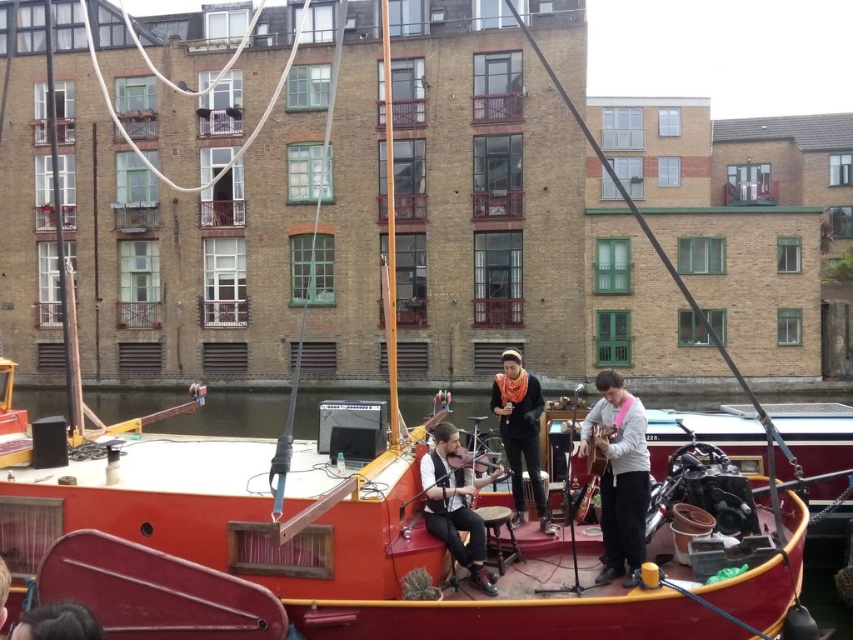
Does matte black violin at center have a smaller size compared to dark brown hair at lower left?

Incorrect, matte black violin at center is not smaller in size than dark brown hair at lower left.

Can you confirm if matte black violin at center is taller than dark brown hair at lower left?

Correct, matte black violin at center is much taller as dark brown hair at lower left.

Where is `matte black violin at center`? The height and width of the screenshot is (640, 853). matte black violin at center is located at coordinates (456, 506).

This screenshot has height=640, width=853. I want to click on matte black violin at center, so click(456, 506).

Can you confirm if smooth wooden boat at center is shorter than wooden acoustic guitar at center?

In fact, smooth wooden boat at center may be taller than wooden acoustic guitar at center.

Is smooth wooden boat at center to the left of wooden acoustic guitar at center from the viewer's perspective?

In fact, smooth wooden boat at center is to the right of wooden acoustic guitar at center.

Between point (700, 401) and point (601, 458), which one is positioned in front?

Point (601, 458) is in front.

Identify the location of smooth wooden boat at center. The width and height of the screenshot is (853, 640). (705, 429).

The image size is (853, 640). Describe the element at coordinates (705, 429) in the screenshot. I see `smooth wooden boat at center` at that location.

Is point (824, 492) closer to viewer compared to point (538, 388)?

That is True.

Between point (242, 406) and point (496, 394), which one is positioned in front?

Point (496, 394)

This screenshot has width=853, height=640. Identify the location of smooth wooden boat at center. (705, 429).